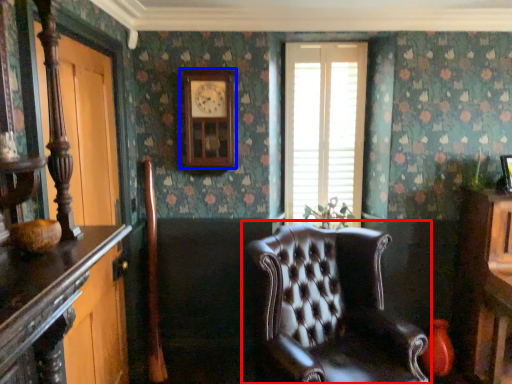
Question: Which object appears closest to the camera in this image, chair (highlighted by a red box) or clock (highlighted by a blue box)?

Choices:
 (A) chair
 (B) clock

Answer: (A)